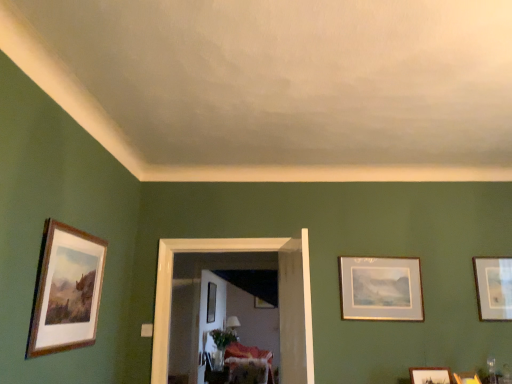
This screenshot has height=384, width=512. What do you see at coordinates (223, 337) in the screenshot? I see `translucent glass vase at center` at bounding box center [223, 337].

Measure the distance between translucent glass vase at center and camera.

They are 4.84 meters apart.

This screenshot has height=384, width=512. What do you see at coordinates (66, 290) in the screenshot? I see `wooden frame at left, which is the first picture frame in left-to-right order` at bounding box center [66, 290].

Describe the element at coordinates (381, 288) in the screenshot. I see `matte wooden picture frame at right, which appears as the 3th picture frame when viewed from the top` at that location.

You are a GUI agent. You are given a task and a screenshot of the screen. Output one action in this format:
    pyautogui.click(x=<x>, y=<y>)
    Task: Click on the translucent glass vase at center
    This screenshot has height=384, width=512.
    Given the screenshot: What is the action you would take?
    pyautogui.click(x=223, y=337)

Between matte wooden picture frame at right, which is the fourth picture frame in right-to-left order, and wooden framed picture at right, the 1th picture frame when ordered from right to left, which one appears on the left side from the viewer's perspective?

From the viewer's perspective, matte wooden picture frame at right, which is the fourth picture frame in right-to-left order, appears more on the left side.

Does matte wooden picture frame at right, which is counted as the 5th picture frame, starting from the front, have a smaller size compared to wooden framed picture at right, the 6th picture frame ordered from the bottom?

No, matte wooden picture frame at right, which is counted as the 5th picture frame, starting from the front, is not smaller than wooden framed picture at right, the 6th picture frame ordered from the bottom.

Considering the sizes of objects matte wooden picture frame at right, which is the fourth picture frame in right-to-left order, and wooden framed picture at right, the 1th picture frame when ordered from right to left, in the image provided, who is thinner, matte wooden picture frame at right, which is the fourth picture frame in right-to-left order, or wooden framed picture at right, the 1th picture frame when ordered from right to left,?

matte wooden picture frame at right, which is the fourth picture frame in right-to-left order, is thinner.

Considering the points (460, 378) and (224, 380), which point is behind, point (460, 378) or point (224, 380)?

Positioned behind is point (224, 380).

Does wooden picture frame at lower right, marked as the sixth picture frame in a left-to-right arrangement, have a lesser height compared to wooden table at center?

Yes, wooden picture frame at lower right, marked as the sixth picture frame in a left-to-right arrangement, is shorter than wooden table at center.

How different are the orientations of wooden picture frame at lower right, which is the second picture frame in right-to-left order, and wooden table at center in degrees?

They differ by 66.1 degrees in their facing directions.

Considering the sizes of objects wooden picture frame at lower right, which appears as the fourth picture frame when viewed from the top, and wooden table at center in the image provided, who is bigger, wooden picture frame at lower right, which appears as the fourth picture frame when viewed from the top, or wooden table at center?

With larger size is wooden table at center.

Considering the relative sizes of wooden table at center and matte wooden picture frame at right, which is the fourth picture frame in right-to-left order, in the image provided, is wooden table at center wider than matte wooden picture frame at right, which is the fourth picture frame in right-to-left order,?

Yes.

From a real-world perspective, does wooden table at center sit lower than matte wooden picture frame at right, which is the fourth picture frame in right-to-left order?

Yes, from a real-world perspective, wooden table at center is under matte wooden picture frame at right, which is the fourth picture frame in right-to-left order.

Is wooden table at center touching matte wooden picture frame at right, which appears as the 3th picture frame when viewed from the top?

wooden table at center and matte wooden picture frame at right, which appears as the 3th picture frame when viewed from the top, are clearly separated.

How much distance is there between wooden table at center and matte wooden picture frame at right, which is counted as the third picture frame, starting from the back?

They are 2.39 meters apart.

Can you see wooden table at center touching matte black picture frame at center, the sixth picture frame from the right?

They are not placed beside each other.

Between wooden table at center and matte black picture frame at center, marked as the second picture frame in a back-to-front arrangement, which one appears on the left side from the viewer's perspective?

matte black picture frame at center, marked as the second picture frame in a back-to-front arrangement.

Can we say wooden table at center lies outside matte black picture frame at center, acting as the second picture frame starting from the bottom?

Yes, wooden table at center is outside of matte black picture frame at center, acting as the second picture frame starting from the bottom.

From the image's perspective, which is above, wooden table at center or matte black picture frame at center, which appears as the sixth picture frame when viewed from the front?

From the image's view, matte black picture frame at center, which appears as the sixth picture frame when viewed from the front, is above.

Do you think matte wooden picture frame at right, which appears as the 3th picture frame when viewed from the top, is within velvet floral sofa at center, or outside of it?

The correct answer is: outside.

From the image's perspective, would you say matte wooden picture frame at right, which is counted as the third picture frame, starting from the back, is shown under velvet floral sofa at center?

No.

Which object is further away from the camera, matte wooden picture frame at right, which is counted as the third picture frame, starting from the back, or velvet floral sofa at center?

velvet floral sofa at center is further away from the camera.

From a real-world perspective, which is physically above, wooden frame at left, which is the first picture frame in left-to-right order, or wooden picture frame at center, which appears as the fifth picture frame when viewed from the right?

wooden picture frame at center, which appears as the fifth picture frame when viewed from the right, from a real-world perspective.

Considering the sizes of objects wooden frame at left, the 7th picture frame viewed from the back, and wooden picture frame at center, the 3th picture frame when ordered from left to right, in the image provided, who is smaller, wooden frame at left, the 7th picture frame viewed from the back, or wooden picture frame at center, the 3th picture frame when ordered from left to right,?

wooden picture frame at center, the 3th picture frame when ordered from left to right.

In the scene shown: Is wooden picture frame at center, the seventh picture frame when ordered from top to bottom, inside wooden frame at left, the seventh picture frame positioned from the bottom?

That's incorrect, wooden picture frame at center, the seventh picture frame when ordered from top to bottom, is not inside wooden frame at left, the seventh picture frame positioned from the bottom.

This screenshot has height=384, width=512. There is a wooden picture frame at center, which appears as the fifth picture frame when viewed from the right. Find the location of `the 1st picture frame below it (from a real-world perspective)`. the 1st picture frame below it (from a real-world perspective) is located at coordinates (66, 290).

Which picture frame is the 2nd one when counting from the front of the wooden table at center? Please provide its 2D coordinates.

[(493, 287)]

Is wooden table at center directly adjacent to wooden framed picture at right, which is the fourth picture frame in back-to-front order?

No, wooden table at center is not with wooden framed picture at right, which is the fourth picture frame in back-to-front order.

Is the depth of wooden table at center greater than that of wooden framed picture at right, which is the fourth picture frame in back-to-front order?

Yes, it is.

Based on the photo, from the image's perspective, is wooden table at center beneath wooden framed picture at right, which is the fourth picture frame in back-to-front order?

Yes.

Locate an element on the screen. picture frame above the matte wooden picture frame at right, which is the fifth picture frame in bottom-to-top order (from a real-world perspective) is located at coordinates (493, 287).

You are a GUI agent. You are given a task and a screenshot of the screen. Output one action in this format:
    pyautogui.click(x=<x>, y=<y>)
    Task: Click on the table behind the wooden picture frame at lower right, which appears as the fourth picture frame when viewed from the top
    Image resolution: width=512 pixels, height=384 pixels.
    Given the screenshot: What is the action you would take?
    pyautogui.click(x=216, y=375)

Consider the image. Looking at the image, which one is located closer to matte wooden picture frame at right, which is the fourth picture frame in left-to-right order, translucent glass vase at center or wooden picture frame at center, arranged as the seventh picture frame when viewed from the front?

wooden picture frame at center, arranged as the seventh picture frame when viewed from the front.

Considering their positions, is wooden framed picture at right, which is the fourth picture frame in back-to-front order, positioned closer to wooden frame at left, the 7th picture frame viewed from the back, than matte wooden picture frame at right, which appears as the 3th picture frame when viewed from the top?

The object closer to wooden frame at left, the 7th picture frame viewed from the back, is matte wooden picture frame at right, which appears as the 3th picture frame when viewed from the top.

Which object lies further to the anchor point wooden frame at upper right, which appears as the 3th picture frame when viewed from the front, matte wooden picture frame at right, which is counted as the third picture frame, starting from the back, or wooden picture frame at lower right, which ranks as the 2th picture frame in front-to-back order?

matte wooden picture frame at right, which is counted as the third picture frame, starting from the back.

When comparing their distances from wooden framed picture at right, placed as the fourth picture frame when sorted from front to back, does matte black picture frame at center, which appears as the sixth picture frame when viewed from the front, or wooden frame at upper right, the fifth picture frame viewed from the left, seem further?

Among the two, matte black picture frame at center, which appears as the sixth picture frame when viewed from the front, is located further to wooden framed picture at right, placed as the fourth picture frame when sorted from front to back.

When comparing their distances from wooden picture frame at lower right, which is the second picture frame in right-to-left order, does wooden frame at left, which is the first picture frame in left-to-right order, or matte black picture frame at center, the 6th picture frame positioned from the top, seem closer?

Among the two, wooden frame at left, which is the first picture frame in left-to-right order, is located nearer to wooden picture frame at lower right, which is the second picture frame in right-to-left order.

Which object lies nearer to the anchor point translucent glass vase at center, velvet floral sofa at center or wooden framed picture at right, the 6th picture frame ordered from the bottom?

velvet floral sofa at center is closer to translucent glass vase at center.

Estimate the real-world distances between objects in this image. Which object is closer to matte wooden picture frame at right, which is counted as the 5th picture frame, starting from the front, velvet floral sofa at center or translucent glass vase at center?

Based on the image, velvet floral sofa at center appears to be nearer to matte wooden picture frame at right, which is counted as the 5th picture frame, starting from the front.

Based on their spatial positions, is wooden framed picture at right, placed as the fourth picture frame when sorted from front to back, or velvet floral sofa at center further from matte wooden picture frame at right, which is the fourth picture frame in right-to-left order?

The object further to matte wooden picture frame at right, which is the fourth picture frame in right-to-left order, is velvet floral sofa at center.

The width and height of the screenshot is (512, 384). Find the location of `table positioned between wooden framed picture at right, the 1th picture frame when ordered from right to left, and velvet floral sofa at center from near to far`. table positioned between wooden framed picture at right, the 1th picture frame when ordered from right to left, and velvet floral sofa at center from near to far is located at coordinates (216, 375).

The image size is (512, 384). I want to click on table between wooden framed picture at right, which is the second picture frame from top to bottom, and matte black picture frame at center, marked as the second picture frame in a back-to-front arrangement, along the z-axis, so click(x=216, y=375).

You are a GUI agent. You are given a task and a screenshot of the screen. Output one action in this format:
    pyautogui.click(x=<x>, y=<y>)
    Task: Click on the plant located between wooden picture frame at lower right, which is the second picture frame in right-to-left order, and velvet floral sofa at center in the depth direction
    The height and width of the screenshot is (384, 512).
    Given the screenshot: What is the action you would take?
    223,337

Locate an element on the screen. Image resolution: width=512 pixels, height=384 pixels. plant between wooden framed picture at right, the 6th picture frame ordered from the bottom, and wooden picture frame at center, the seventh picture frame when ordered from top to bottom, in the front-back direction is located at coordinates (223, 337).